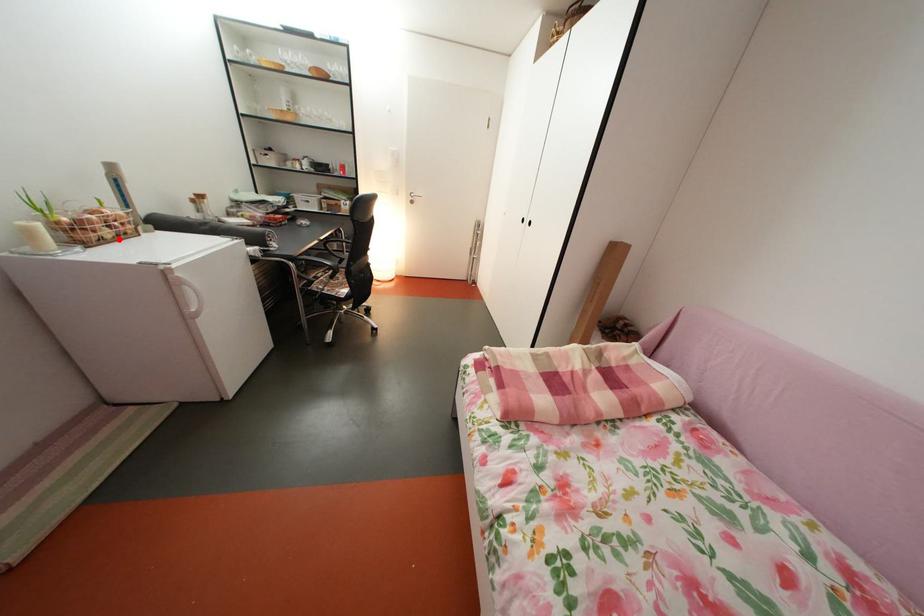
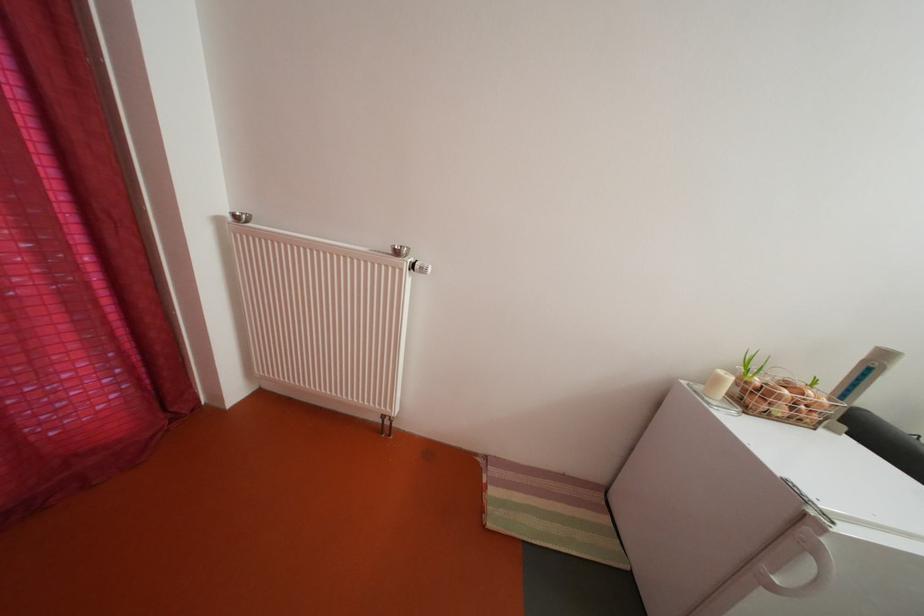
Locate, in the second image, the point that corresponds to the highlighted location in the first image.

(792, 416)